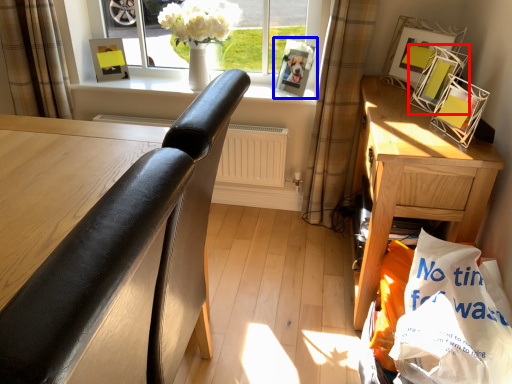
Question: Which object is further to the camera taking this photo, picture frame (highlighted by a red box) or picture frame (highlighted by a blue box)?

Choices:
 (A) picture frame
 (B) picture frame

Answer: (B)